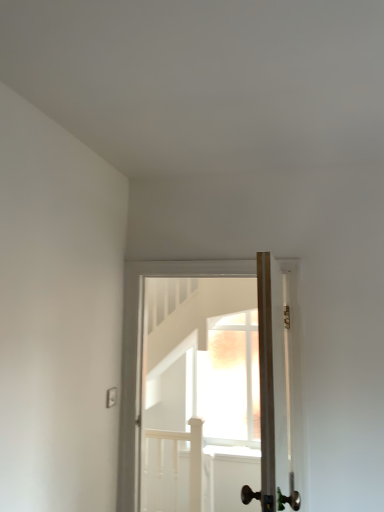
Where is `wooden door at center, which is counted as the second door, starting from the back`? wooden door at center, which is counted as the second door, starting from the back is located at coordinates (276, 387).

What do you see at coordinates (276, 387) in the screenshot?
I see `wooden door at center, which is counted as the second door, starting from the back` at bounding box center [276, 387].

Where is `wooden door at center, positioned as the second door in front-to-back order`? The width and height of the screenshot is (384, 512). wooden door at center, positioned as the second door in front-to-back order is located at coordinates (209, 387).

What do you see at coordinates (209, 387) in the screenshot? I see `wooden door at center, positioned as the second door in front-to-back order` at bounding box center [209, 387].

You are a GUI agent. You are given a task and a screenshot of the screen. Output one action in this format:
    pyautogui.click(x=<x>, y=<y>)
    Task: Click on the wooden door at center, which is counted as the second door, starting from the back
    
    Given the screenshot: What is the action you would take?
    pyautogui.click(x=276, y=387)

Is wooden door at center, positioned as the second door in front-to-back order, to the right of wooden door at center, which is counted as the second door, starting from the back, from the viewer's perspective?

In fact, wooden door at center, positioned as the second door in front-to-back order, is to the left of wooden door at center, which is counted as the second door, starting from the back.

Between wooden door at center, positioned as the second door in front-to-back order, and wooden door at center, which is counted as the second door, starting from the back, which one is positioned in front?

wooden door at center, which is counted as the second door, starting from the back.

Is point (149, 360) closer to viewer compared to point (262, 340)?

No.

From the image's perspective, which is below, wooden door at center, positioned as the second door in front-to-back order, or wooden door at center, which ranks as the 1th door in front-to-back order?

wooden door at center, positioned as the second door in front-to-back order, appears lower in the image.

From a real-world perspective, is wooden door at center, which is the first door from back to front, physically located above or below wooden door at center, which is counted as the second door, starting from the back?

wooden door at center, which is the first door from back to front, is situated lower than wooden door at center, which is counted as the second door, starting from the back, in the real world.

Looking at their sizes, would you say wooden door at center, which is the first door from back to front, is wider or thinner than wooden door at center, which ranks as the 1th door in front-to-back order?

wooden door at center, which is the first door from back to front, is wider than wooden door at center, which ranks as the 1th door in front-to-back order.

Considering the relative sizes of wooden door at center, which is the first door from back to front, and wooden door at center, which is counted as the second door, starting from the back, in the image provided, is wooden door at center, which is the first door from back to front, taller than wooden door at center, which is counted as the second door, starting from the back,?

Yes, wooden door at center, which is the first door from back to front, is taller than wooden door at center, which is counted as the second door, starting from the back.

In terms of size, does wooden door at center, which is the first door from back to front, appear bigger or smaller than wooden door at center, which ranks as the 1th door in front-to-back order?

wooden door at center, which is the first door from back to front, is bigger than wooden door at center, which ranks as the 1th door in front-to-back order.

Is wooden door at center, which is the first door from back to front, surrounding wooden door at center, which ranks as the 1th door in front-to-back order?

No, wooden door at center, which is the first door from back to front, does not contain wooden door at center, which ranks as the 1th door in front-to-back order.

Is wooden door at center, positioned as the second door in front-to-back order, in contact with wooden door at center, which ranks as the 1th door in front-to-back order?

No, wooden door at center, positioned as the second door in front-to-back order, is not beside wooden door at center, which ranks as the 1th door in front-to-back order.

Could you tell me if wooden door at center, positioned as the second door in front-to-back order, is facing wooden door at center, which ranks as the 1th door in front-to-back order?

Yes, wooden door at center, positioned as the second door in front-to-back order, is oriented towards wooden door at center, which ranks as the 1th door in front-to-back order.

Can you tell me how much wooden door at center, which is the first door from back to front, and wooden door at center, which is counted as the second door, starting from the back, differ in facing direction?

The angle between the facing direction of wooden door at center, which is the first door from back to front, and the facing direction of wooden door at center, which is counted as the second door, starting from the back, is 89.2 degrees.

Measure the distance from wooden door at center, positioned as the second door in front-to-back order, to wooden door at center, which is counted as the second door, starting from the back.

The distance of wooden door at center, positioned as the second door in front-to-back order, from wooden door at center, which is counted as the second door, starting from the back, is 2.05 meters.

Find the location of a particular element. The width and height of the screenshot is (384, 512). door that is in front of the wooden door at center, positioned as the second door in front-to-back order is located at coordinates (276, 387).

Considering the relative positions of wooden door at center, which ranks as the 1th door in front-to-back order, and wooden door at center, positioned as the second door in front-to-back order, in the image provided, is wooden door at center, which ranks as the 1th door in front-to-back order, to the left of wooden door at center, positioned as the second door in front-to-back order, from the viewer's perspective?

No.

Is wooden door at center, which is counted as the second door, starting from the back, closer to camera compared to wooden door at center, positioned as the second door in front-to-back order?

Yes, it is in front of wooden door at center, positioned as the second door in front-to-back order.

Which is in front, point (287, 422) or point (214, 262)?

The point (287, 422) is more forward.

From the picture: From the image's perspective, which is below, wooden door at center, which is counted as the second door, starting from the back, or wooden door at center, positioned as the second door in front-to-back order?

wooden door at center, positioned as the second door in front-to-back order, is shown below in the image.

From a real-world perspective, between wooden door at center, which ranks as the 1th door in front-to-back order, and wooden door at center, which is the first door from back to front, who is vertically lower?

wooden door at center, which is the first door from back to front.

Does wooden door at center, which is counted as the second door, starting from the back, have a lesser width compared to wooden door at center, which is the first door from back to front?

Yes.

Who is taller, wooden door at center, which is counted as the second door, starting from the back, or wooden door at center, which is the first door from back to front?

Standing taller between the two is wooden door at center, which is the first door from back to front.

Considering the sizes of objects wooden door at center, which is counted as the second door, starting from the back, and wooden door at center, which is the first door from back to front, in the image provided, who is bigger, wooden door at center, which is counted as the second door, starting from the back, or wooden door at center, which is the first door from back to front,?

wooden door at center, which is the first door from back to front.

Is wooden door at center, which is counted as the second door, starting from the back, spatially inside wooden door at center, positioned as the second door in front-to-back order, or outside of it?

wooden door at center, which is counted as the second door, starting from the back, is outside wooden door at center, positioned as the second door in front-to-back order.

Looking at this image, is wooden door at center, which ranks as the 1th door in front-to-back order, not near wooden door at center, positioned as the second door in front-to-back order?

Yes, wooden door at center, which ranks as the 1th door in front-to-back order, and wooden door at center, positioned as the second door in front-to-back order, are located far from each other.

Is wooden door at center, which ranks as the 1th door in front-to-back order, turned away from wooden door at center, which is the first door from back to front?

No, wooden door at center, which ranks as the 1th door in front-to-back order,'s orientation is not away from wooden door at center, which is the first door from back to front.

Locate an element on the screen. This screenshot has width=384, height=512. door lying above the wooden door at center, which is the first door from back to front (from the image's perspective) is located at coordinates (276, 387).

Locate an element on the screen. door that appears below the wooden door at center, which is counted as the second door, starting from the back (from the image's perspective) is located at coordinates (209, 387).

The height and width of the screenshot is (512, 384). Identify the location of door below the wooden door at center, which is counted as the second door, starting from the back (from a real-world perspective). (209, 387).